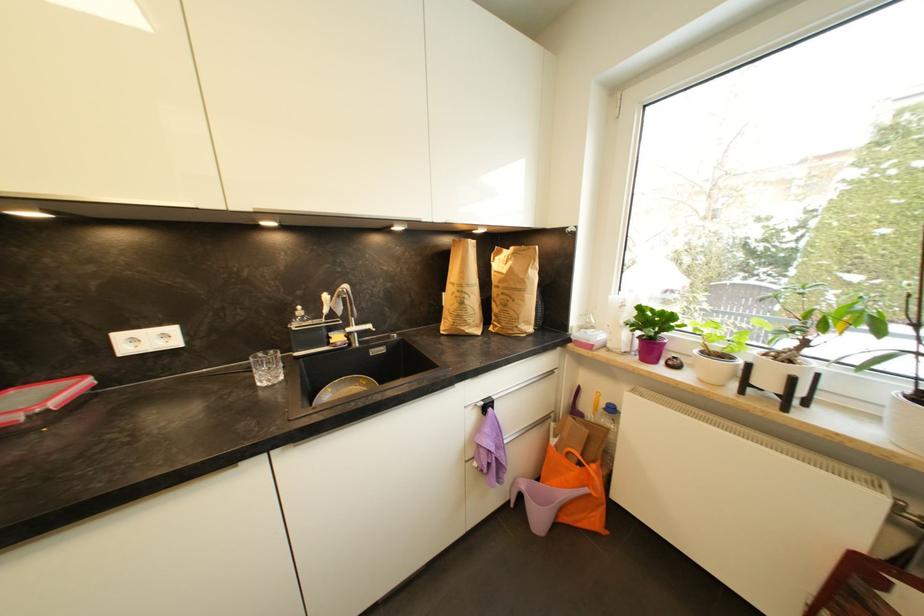
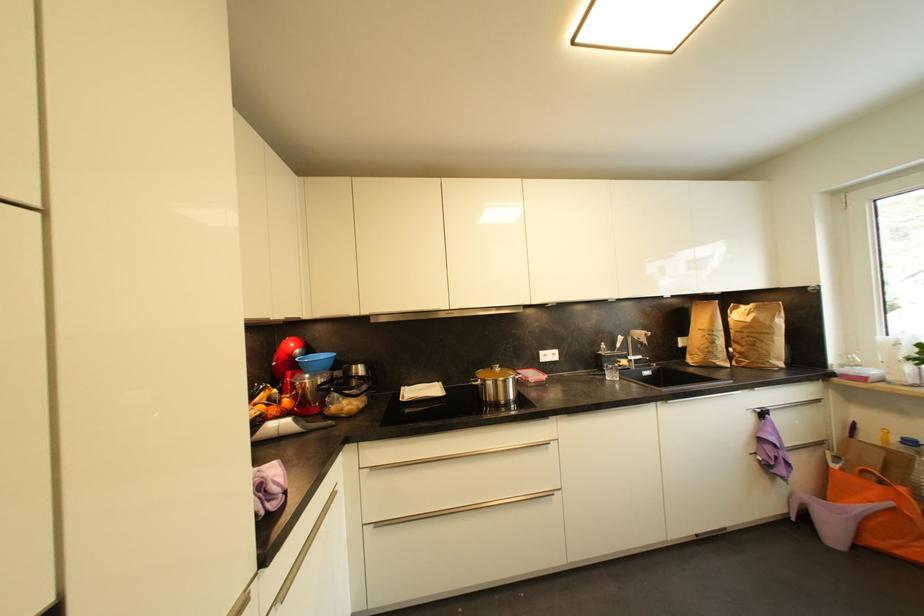
Locate, in the second image, the point that corresponds to the point at 527,485 in the first image.

(811, 498)